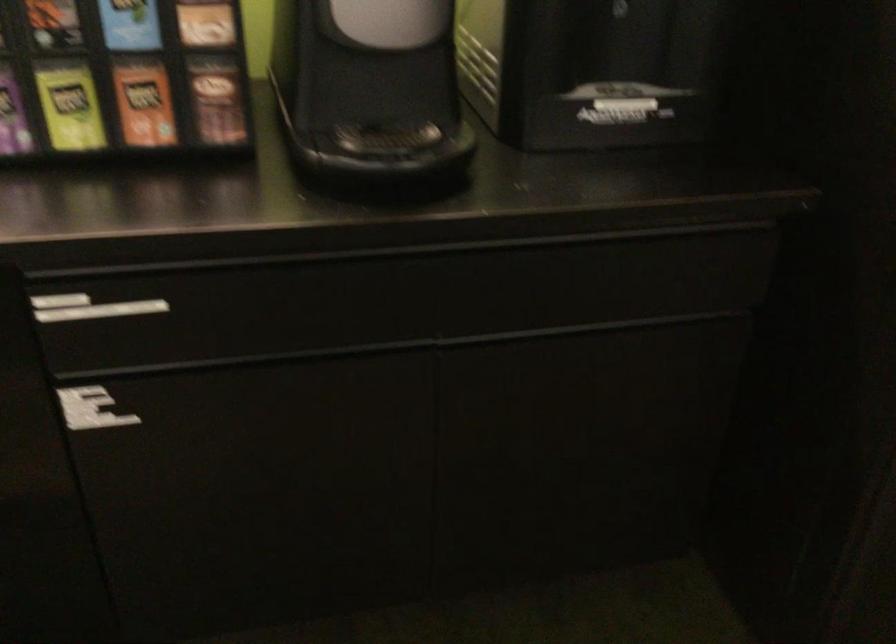
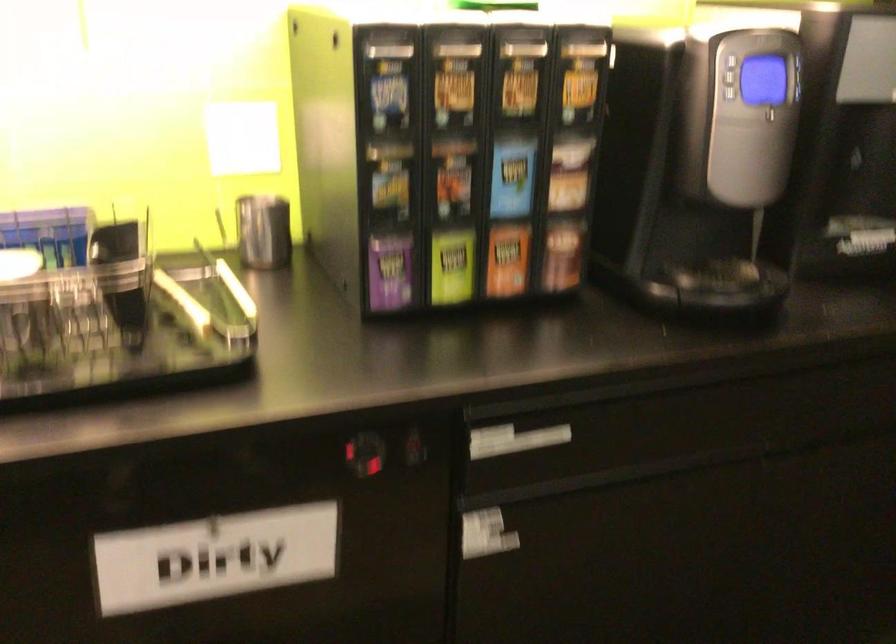
Question: The first image is from the beginning of the video and the second image is from the end. How did the camera likely rotate when shooting the video?

Choices:
 (A) Left
 (B) Right
 (C) Up
 (D) Down

Answer: (C)